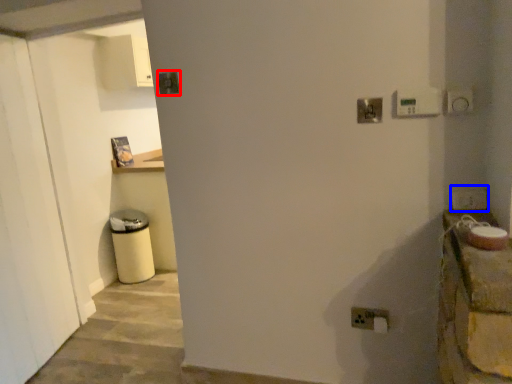
Question: Which of the following is the closest to the observer, light switch (highlighted by a red box) or light switch (highlighted by a blue box)?

Choices:
 (A) light switch
 (B) light switch

Answer: (B)